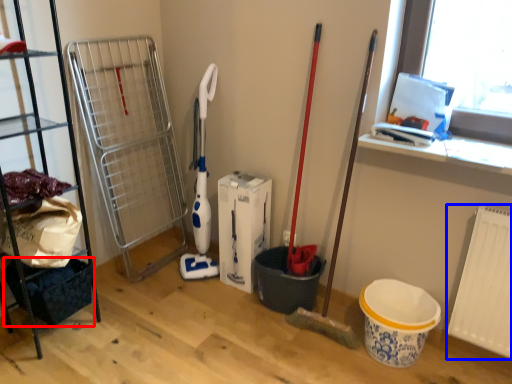
Question: Which object is further to the camera taking this photo, basket (highlighted by a red box) or radiator (highlighted by a blue box)?

Choices:
 (A) basket
 (B) radiator

Answer: (A)